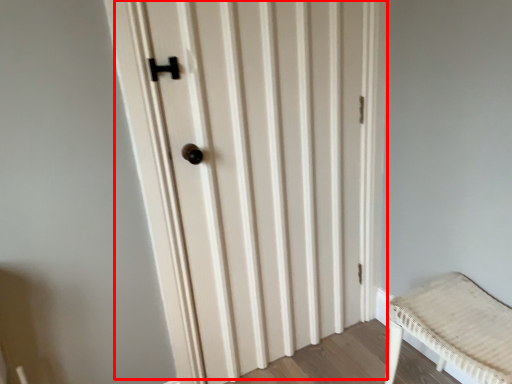
Question: From the image's perspective, what is the correct spatial relationship of door (annotated by the red box) in relation to furniture?

Choices:
 (A) below
 (B) above

Answer: (B)